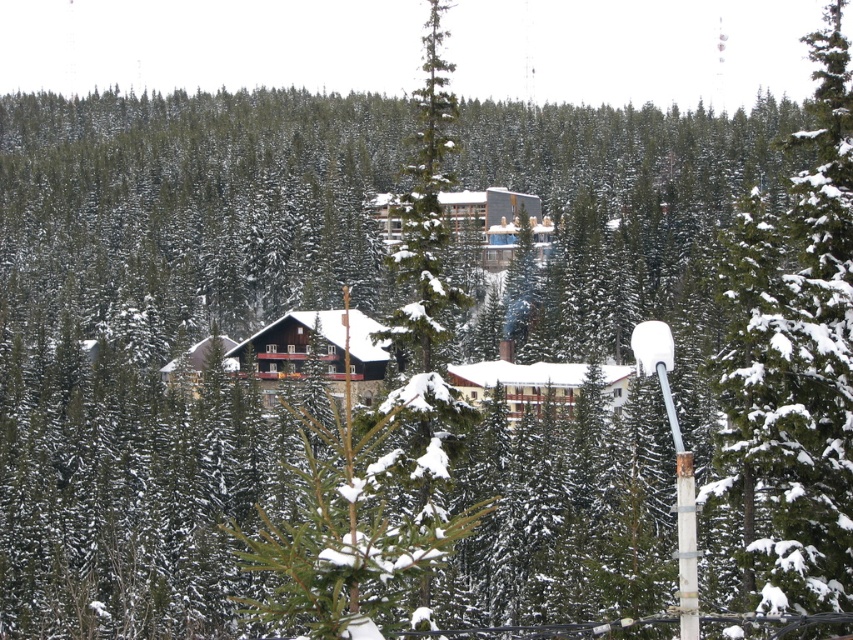
Locate an element on the screen. green textured pine tree at center is located at coordinates (793, 362).

Who is more distant from viewer, (778, 292) or (357, 336)?

Positioned behind is point (357, 336).

Find the location of a particular element. green textured pine tree at center is located at coordinates coord(793,362).

Between dark brown wooden cabin at center and white wood cabin at center, which one has more height?

With more height is dark brown wooden cabin at center.

In the scene shown: Does dark brown wooden cabin at center have a larger size compared to white wood cabin at center?

Yes.

Which is behind, point (254, 362) or point (561, 385)?

Point (254, 362)

You are a GUI agent. You are given a task and a screenshot of the screen. Output one action in this format:
    pyautogui.click(x=<x>, y=<y>)
    Task: Click on the dark brown wooden cabin at center
    
    Given the screenshot: What is the action you would take?
    pyautogui.click(x=314, y=346)

Which of these two, green textured pine tree at center or white wood cabin at center, stands taller?

green textured pine tree at center

Is green textured pine tree at center bigger than white wood cabin at center?

Indeed, green textured pine tree at center has a larger size compared to white wood cabin at center.

In order to click on green textured pine tree at center in this screenshot , I will do `click(793, 362)`.